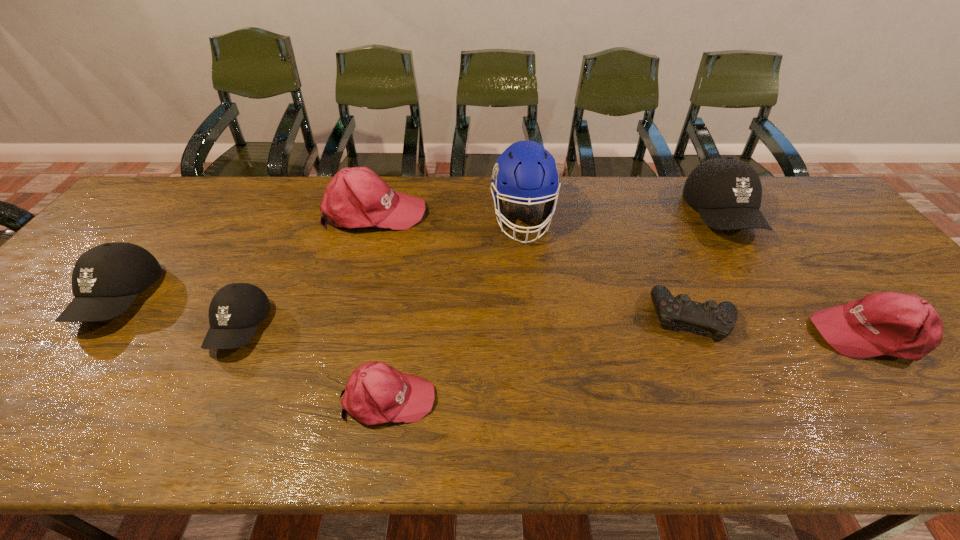
At what (x,y) coordinates should I click in order to perform the action: click on empty space that is in between the shortest object and the smallest red baseball cap. Please return your answer as a coordinate pair (x, y). Looking at the image, I should click on (540, 357).

The image size is (960, 540). Identify the location of vacant area that lies between the nearest red baseball cap and the second smallest red baseball cap. [x=629, y=366].

Image resolution: width=960 pixels, height=540 pixels. In order to click on free space between the second biggest red baseball cap and the leftmost object in this screenshot , I will do `click(493, 316)`.

You are a GUI agent. You are given a task and a screenshot of the screen. Output one action in this format:
    pyautogui.click(x=<x>, y=<y>)
    Task: Click on the vacant area between the second object from left to right and the biggest black baseball cap
    Image resolution: width=960 pixels, height=540 pixels.
    Given the screenshot: What is the action you would take?
    pyautogui.click(x=481, y=272)

Where is `object that can be found as the third closest to the farthest black baseball cap`? object that can be found as the third closest to the farthest black baseball cap is located at coordinates (525, 172).

This screenshot has height=540, width=960. In order to click on object that can be found as the sixth closest to the control in this screenshot , I will do `click(235, 311)`.

Locate which baseball cap ranks fourth in proximity to the second smallest red baseball cap. Please provide its 2D coordinates. Your answer should be formatted as a tuple, i.e. [(x, y)], where the tuple contains the x and y coordinates of a point satisfying the conditions above.

[(235, 311)]

Identify which baseball cap is the second nearest to the smallest black baseball cap. Please provide its 2D coordinates. Your answer should be formatted as a tuple, i.e. [(x, y)], where the tuple contains the x and y coordinates of a point satisfying the conditions above.

[(376, 393)]

Where is `black baseball cap that is the closest to the rightmost red baseball cap`? black baseball cap that is the closest to the rightmost red baseball cap is located at coordinates (727, 192).

Identify which black baseball cap is the third closest to the third object from right to left. Please provide its 2D coordinates. Your answer should be formatted as a tuple, i.e. [(x, y)], where the tuple contains the x and y coordinates of a point satisfying the conditions above.

[(106, 279)]